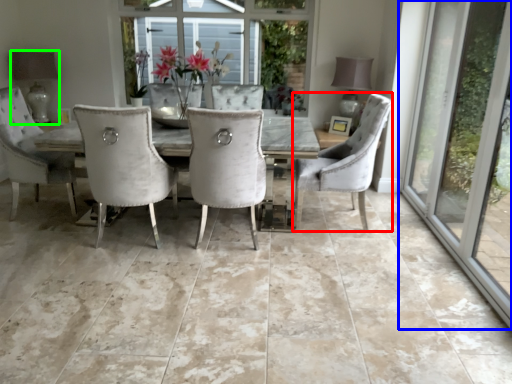
Question: Which object is the closest to the chair (highlighted by a red box)? Choose among these: window (highlighted by a blue box) or lamp (highlighted by a green box).

Choices:
 (A) window
 (B) lamp

Answer: (A)